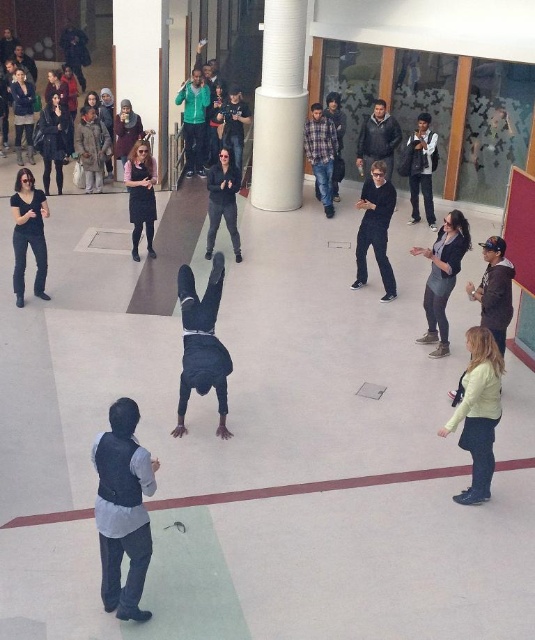
You are organizing a photo shoot in the atrium and need to position two models wearing the dark gray fabric jacket at center and the dark gray jacket at upper center. According to the scene, which model should stand closer to the camera to ensure both appear proportionate in the final image?

The dark gray jacket at upper center should stand closer to the camera because it is shorter than the dark gray fabric jacket at center, balancing their apparent sizes.

From the picture: You are organizing a coat check for an event and have two jackets to hang. The denim jacket at lower right and the light brown leather jacket at center. Which jacket requires a wider hanger?

The light brown leather jacket at center requires a wider hanger since it is thicker than the denim jacket at lower right.

You are organizing a photo shoot and need to ensure that the black matte person at center and the plaid fabric shirt at upper center are both visible in the frame. Given their sizes, which object should you adjust the camera focus to prioritize to ensure both are in the frame?

The black matte person at center is bigger than the plaid fabric shirt at upper center. To ensure both are in the frame, prioritize focusing on the black matte person at center first, then adjust the camera angle to include the smaller plaid fabric shirt at upper center.